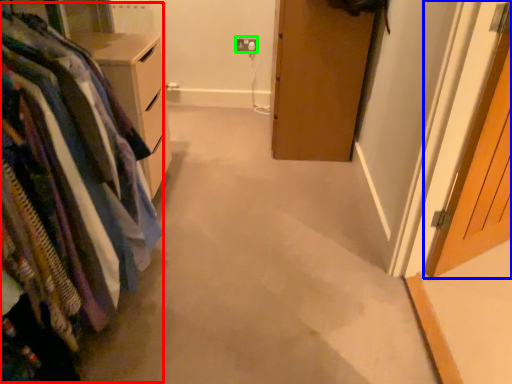
Question: Based on their relative distances, which object is farther from closet (highlighted by a red box)? Choose from door (highlighted by a blue box) and electric outlet (highlighted by a green box).

Choices:
 (A) door
 (B) electric outlet

Answer: (B)